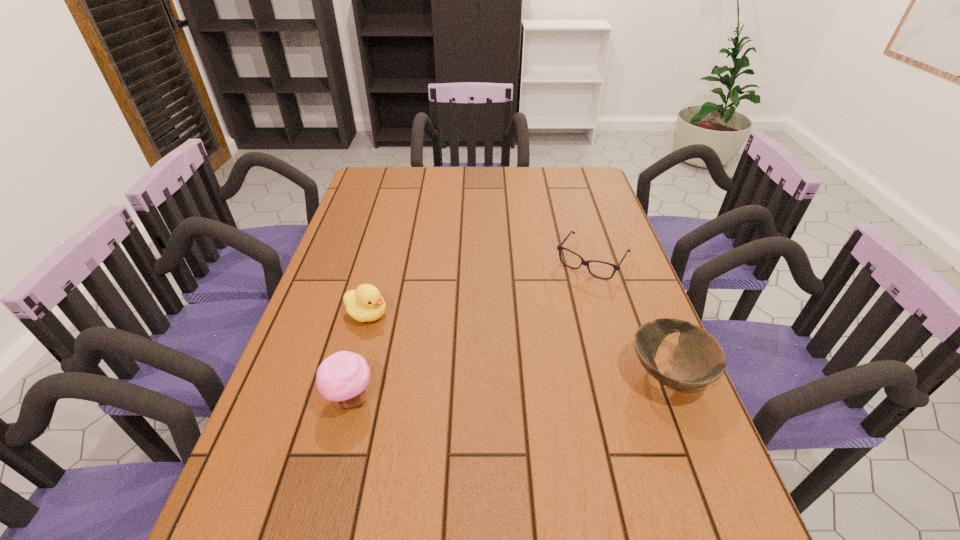
Identify the location of vacant region at the right edge. pyautogui.click(x=586, y=234).

Where is `free point at the far left corner`? The height and width of the screenshot is (540, 960). free point at the far left corner is located at coordinates (376, 191).

This screenshot has height=540, width=960. What are the coordinates of `vacant space at the far right corner of the desktop` in the screenshot? It's located at (558, 182).

Image resolution: width=960 pixels, height=540 pixels. Find the location of `vacant area between the cupcake and the bowl`. vacant area between the cupcake and the bowl is located at coordinates (509, 387).

Where is `vacant region between the bowl and the cupcake`? The width and height of the screenshot is (960, 540). vacant region between the bowl and the cupcake is located at coordinates (509, 387).

Where is `free space between the bowl and the farthest object`? This screenshot has width=960, height=540. free space between the bowl and the farthest object is located at coordinates (630, 318).

This screenshot has width=960, height=540. In order to click on vacant area that lies between the duckling and the bowl in this screenshot , I will do `click(517, 345)`.

At what (x,y) coordinates should I click in order to perform the action: click on free space between the cupcake and the bowl. Please return your answer as a coordinate pair (x, y). Image resolution: width=960 pixels, height=540 pixels. Looking at the image, I should click on (509, 387).

The height and width of the screenshot is (540, 960). What are the coordinates of `free spot between the bowl and the cupcake` in the screenshot? It's located at (509, 387).

Find the location of a particular element. This screenshot has height=540, width=960. vacant region between the farthest object and the bowl is located at coordinates (x=630, y=318).